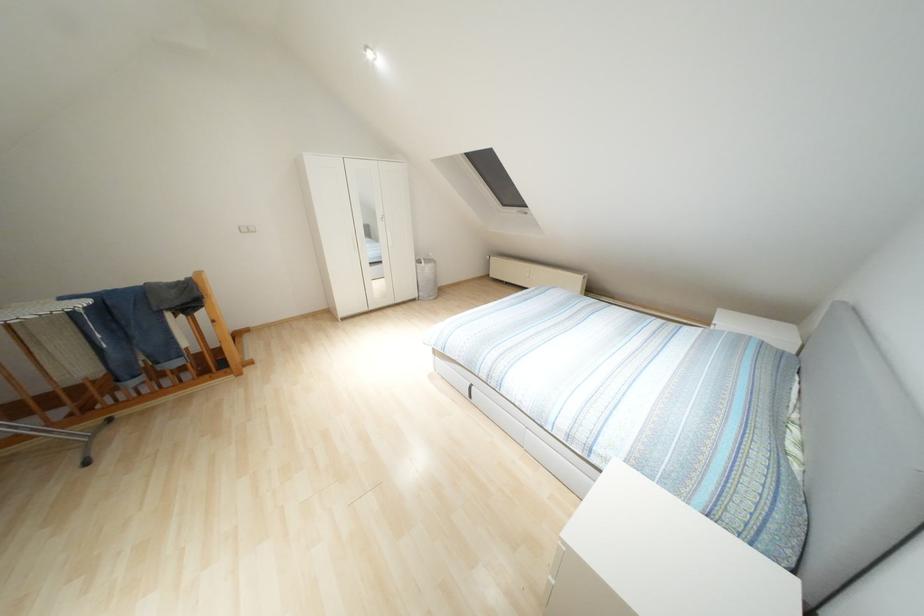
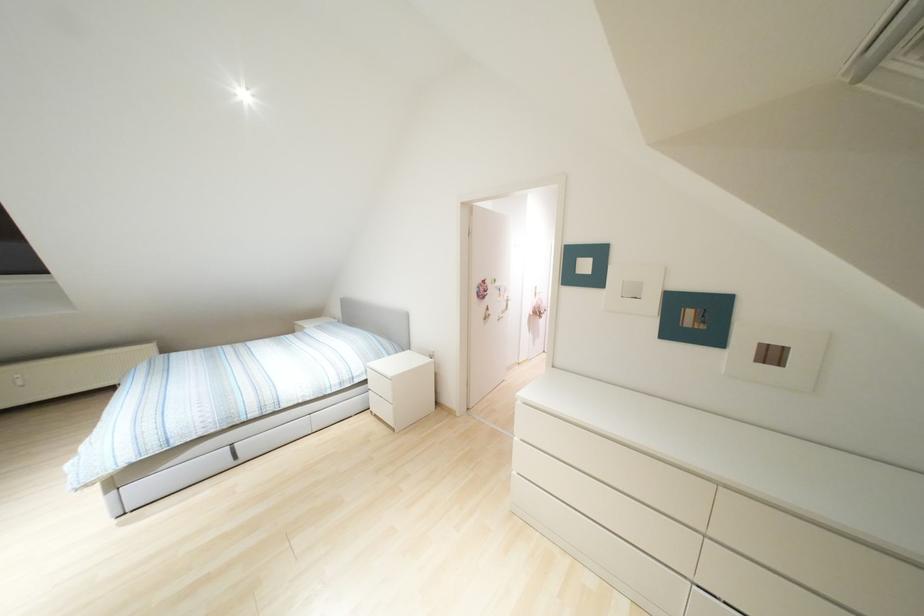
Locate, in the second image, the point that corresponds to point (469, 397) in the first image.

(235, 456)